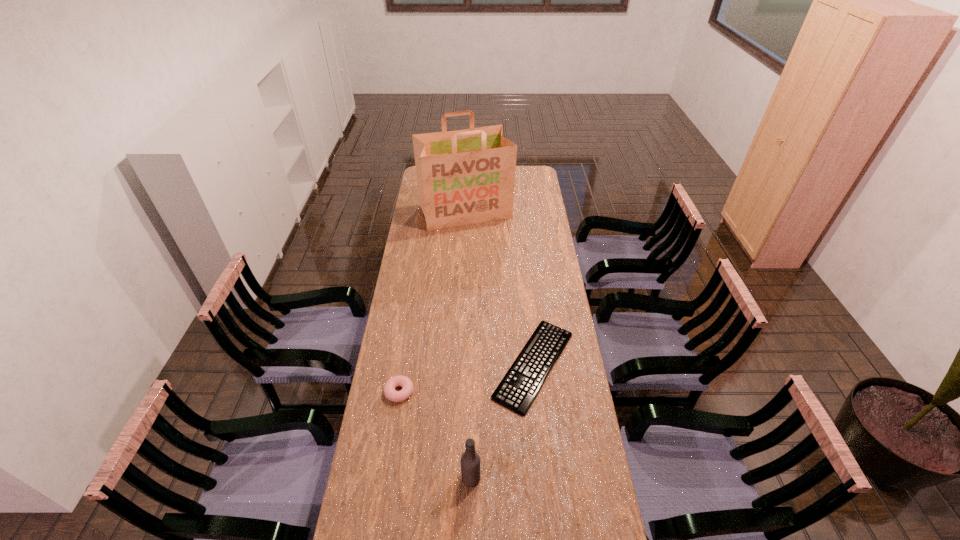
Where is `the farthest object`? Image resolution: width=960 pixels, height=540 pixels. the farthest object is located at coordinates (464, 177).

Image resolution: width=960 pixels, height=540 pixels. I want to click on the tallest object, so click(x=464, y=177).

I want to click on beer bottle, so click(470, 460).

Find the location of a particular element. This screenshot has height=540, width=960. the nearest object is located at coordinates (470, 460).

Find the location of a particular element. The width and height of the screenshot is (960, 540). doughnut is located at coordinates (407, 386).

The image size is (960, 540). Identify the location of computer keyboard. (518, 389).

This screenshot has height=540, width=960. I want to click on vacant space positioned 0.180m on the back of the grocery bag, so (467, 179).

At what (x,y) coordinates should I click in order to perform the action: click on vacant space situated 0.060m on the side of the nearest object with the label. Please return your answer as a coordinate pair (x, y). Looking at the image, I should click on [500, 478].

Identify the location of vacant space situated on the right of the doughnut. (450, 392).

Where is `vacant space located on the back of the shortest object`? This screenshot has width=960, height=540. vacant space located on the back of the shortest object is located at coordinates (527, 305).